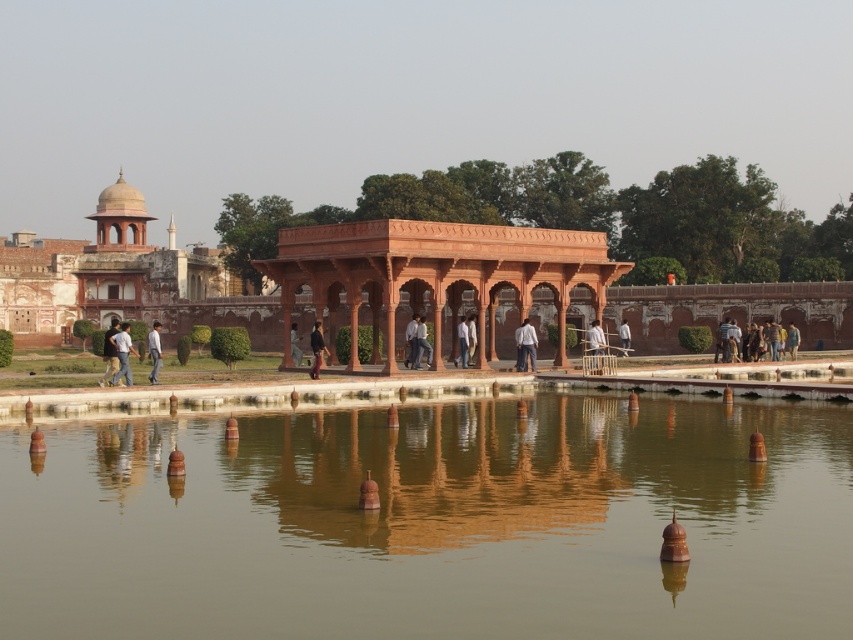
You are a visitor at this historical site and want to take a photo of the matte orange gazebo at center and the light brown wooden stick at center. Which object should you focus on first if you want to capture both in a single frame without moving the camera?

You should focus on the matte orange gazebo at center first because it is positioned over the light brown wooden stick at center, meaning the gazebo is closer to the camera. By focusing on the closer object, both will be in focus in the same frame.

You are a visitor at this historical site and want to sit down to rest. You see both the light brown wooden bench at right and the light brown wooden chair at center. Which one is taller?

The light brown wooden chair at center is taller than the light brown wooden bench at right.